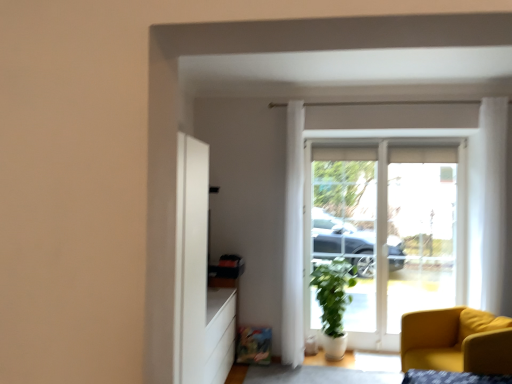
Question: Can you confirm if white glass door at center is shorter than white sheer curtain at upper right, the second curtain from the back?

Choices:
 (A) yes
 (B) no

Answer: (B)

Question: Is white glass door at center positioned with its back to white sheer curtain at upper right, which is the first curtain in front-to-back order?

Choices:
 (A) yes
 (B) no

Answer: (B)

Question: Is white glass door at center thinner than white sheer curtain at upper right, which is the second curtain in left-to-right order?

Choices:
 (A) no
 (B) yes

Answer: (B)

Question: Is white glass door at center not inside white sheer curtain at upper right, which is the first curtain in front-to-back order?

Choices:
 (A) no
 (B) yes

Answer: (B)

Question: Would you consider white glass door at center to be distant from white sheer curtain at upper right, which is the first curtain in front-to-back order?

Choices:
 (A) yes
 (B) no

Answer: (B)

Question: From a real-world perspective, is green matte plant at center positioned above or below matte yellow armchair at lower right?

Choices:
 (A) below
 (B) above

Answer: (B)

Question: Considering the positions of green matte plant at center and matte yellow armchair at lower right in the image, is green matte plant at center taller or shorter than matte yellow armchair at lower right?

Choices:
 (A) tall
 (B) short

Answer: (A)

Question: Is green matte plant at center inside the boundaries of matte yellow armchair at lower right, or outside?

Choices:
 (A) inside
 (B) outside

Answer: (B)

Question: Looking at their shapes, would you say green matte plant at center is wider or thinner than matte yellow armchair at lower right?

Choices:
 (A) thin
 (B) wide

Answer: (A)

Question: In the image, is matte yellow armchair at lower right positioned in front of or behind green matte plant at center?

Choices:
 (A) front
 (B) behind

Answer: (A)

Question: Based on their sizes in the image, would you say matte yellow armchair at lower right is bigger or smaller than green matte plant at center?

Choices:
 (A) small
 (B) big

Answer: (B)

Question: From the image's perspective, relative to green matte plant at center, is matte yellow armchair at lower right above or below?

Choices:
 (A) below
 (B) above

Answer: (A)

Question: Visually, is matte yellow armchair at lower right positioned to the left or to the right of green matte plant at center?

Choices:
 (A) left
 (B) right

Answer: (B)

Question: Based on their positions, is white sheer curtain at upper right, which is the first curtain in front-to-back order, located to the left or right of white glass door at center?

Choices:
 (A) right
 (B) left

Answer: (A)

Question: From their relative heights in the image, would you say white sheer curtain at upper right, the first curtain positioned from the right, is taller or shorter than white glass door at center?

Choices:
 (A) short
 (B) tall

Answer: (A)